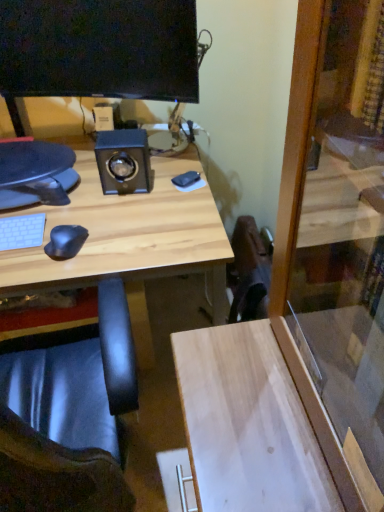
Where is `wooden desk at center`? Image resolution: width=384 pixels, height=512 pixels. wooden desk at center is located at coordinates (131, 234).

Describe the element at coordinates (131, 234) in the screenshot. I see `wooden desk at center` at that location.

Find the location of a particular element. The image size is (384, 512). wooden desk at center is located at coordinates (131, 234).